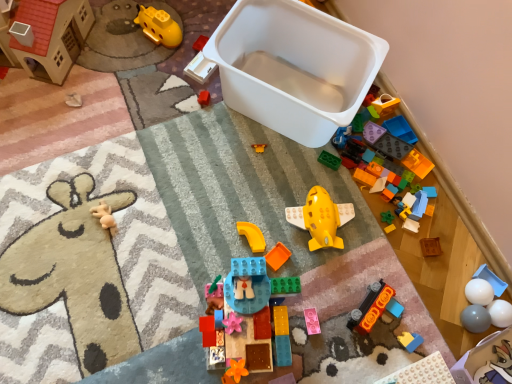
This screenshot has width=512, height=384. What are the coordinates of `vacant area that lies between beige rubber bear at left, which ranks as the 15th toy in right-to-left order, and cardboard house at upper left, the 1th toy positioned from the left` in the screenshot? It's located at (70, 129).